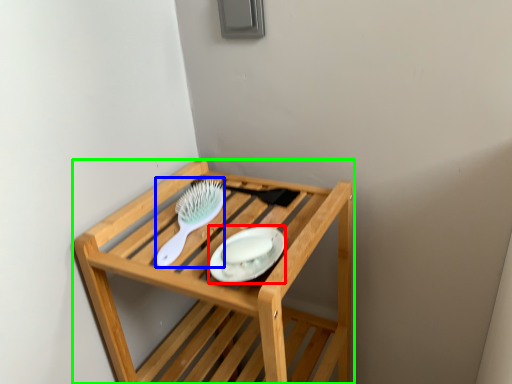
Question: Based on their relative distances, which object is nearer to platter (highlighted by a red box)? Choose from brush (highlighted by a blue box) and furniture (highlighted by a green box).

Choices:
 (A) brush
 (B) furniture

Answer: (A)